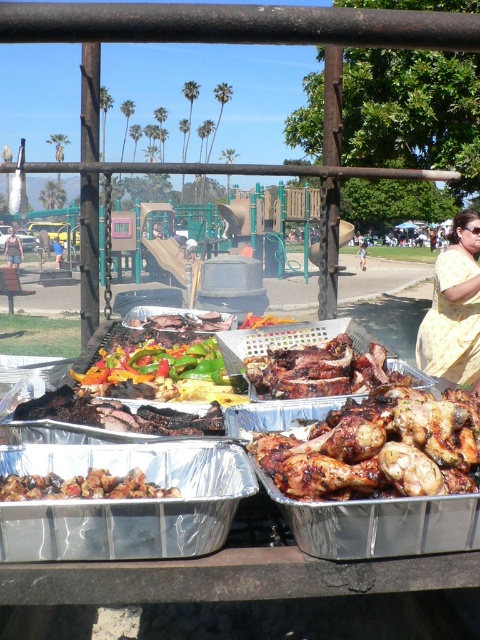
Can you confirm if charred wood steak at center is positioned below vibrant green bell peppers at center?

Yes, charred wood steak at center is below vibrant green bell peppers at center.

Is charred wood steak at center to the right of vibrant green bell peppers at center from the viewer's perspective?

Yes, charred wood steak at center is to the right of vibrant green bell peppers at center.

What do you see at coordinates (119, 413) in the screenshot? This screenshot has height=640, width=480. I see `charred wood steak at center` at bounding box center [119, 413].

Where is `charred wood steak at center`? charred wood steak at center is located at coordinates (119, 413).

Does shiny green peppers at center appear on the right side of brown matte ribs at center?

Incorrect, shiny green peppers at center is not on the right side of brown matte ribs at center.

Which is in front, point (144, 346) or point (124, 477)?

Positioned in front is point (124, 477).

Image resolution: width=480 pixels, height=640 pixels. I want to click on shiny green peppers at center, so 163,372.

At what (x,y) coordinates should I click in order to perform the action: click on shiny green peppers at center. Please return your answer as a coordinate pair (x, y). The image size is (480, 640). Looking at the image, I should click on (163, 372).

Is brown matte ribs at center positioned before vibrant green bell peppers at center?

That is True.

The height and width of the screenshot is (640, 480). Find the location of `brown matte ribs at center`. brown matte ribs at center is located at coordinates (82, 486).

In order to click on brown matte ribs at center in this screenshot , I will do `click(82, 486)`.